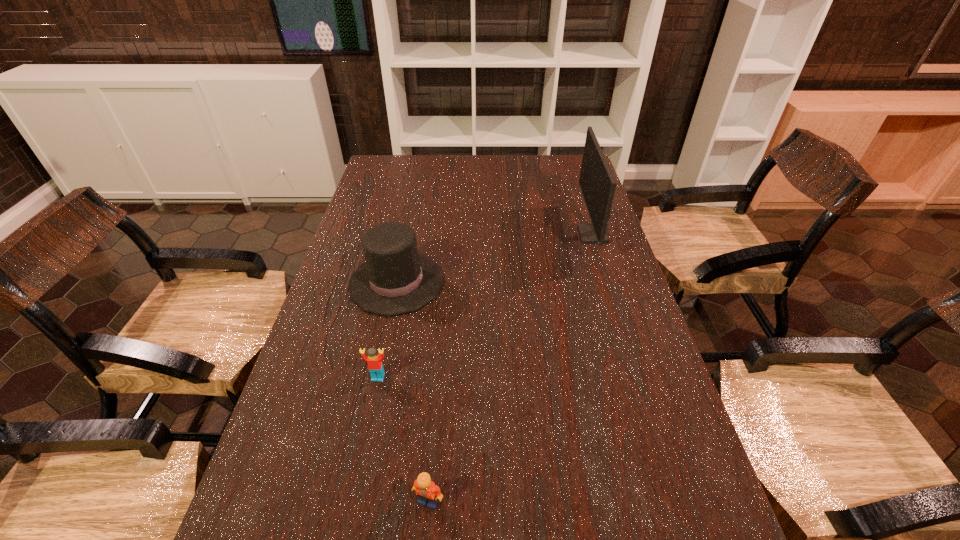
This screenshot has width=960, height=540. I want to click on free space located on the front of the dress hat with the decoration, so click(x=488, y=282).

Find the location of a particular element. The height and width of the screenshot is (540, 960). free space located on the face of the second nearest object is located at coordinates (350, 514).

At what (x,y) coordinates should I click in order to perform the action: click on object that is positioned at the left edge. Please return your answer as a coordinate pair (x, y). Looking at the image, I should click on (395, 279).

Image resolution: width=960 pixels, height=540 pixels. Find the location of `object situated at the right edge`. object situated at the right edge is located at coordinates (597, 183).

Where is `vacant point at the far edge`? The height and width of the screenshot is (540, 960). vacant point at the far edge is located at coordinates (425, 168).

Where is `free point at the left edge`? This screenshot has width=960, height=540. free point at the left edge is located at coordinates click(308, 348).

At what (x,y) coordinates should I click in order to perform the action: click on vacant area at the right edge of the desktop. Please return your answer as a coordinate pair (x, y). Image resolution: width=960 pixels, height=540 pixels. Looking at the image, I should click on pyautogui.click(x=647, y=336).

What are the coordinates of `vacant area at the far right corner of the desktop` in the screenshot? It's located at (549, 169).

You are a GUI agent. You are given a task and a screenshot of the screen. Output one action in this format:
    pyautogui.click(x=<x>, y=<y>)
    Task: Click on the free space between the dress hat and the nearer Lego
    This screenshot has width=960, height=540.
    Given the screenshot: What is the action you would take?
    pyautogui.click(x=413, y=392)

Where is `free space between the dress hat and the computer monitor`? Image resolution: width=960 pixels, height=540 pixels. free space between the dress hat and the computer monitor is located at coordinates (494, 258).